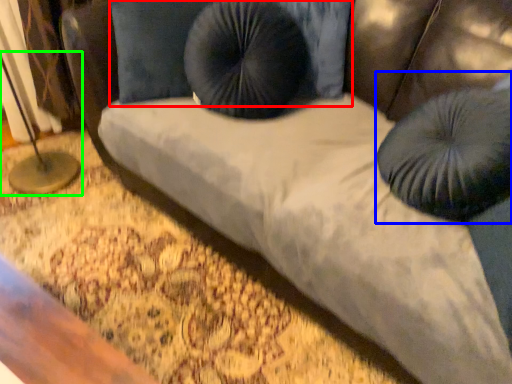
Question: Estimate the real-world distances between objects in this image. Which object is farther from pillow (highlighted by a red box), bean bag chair (highlighted by a blue box) or table lamp (highlighted by a green box)?

Choices:
 (A) bean bag chair
 (B) table lamp

Answer: (A)